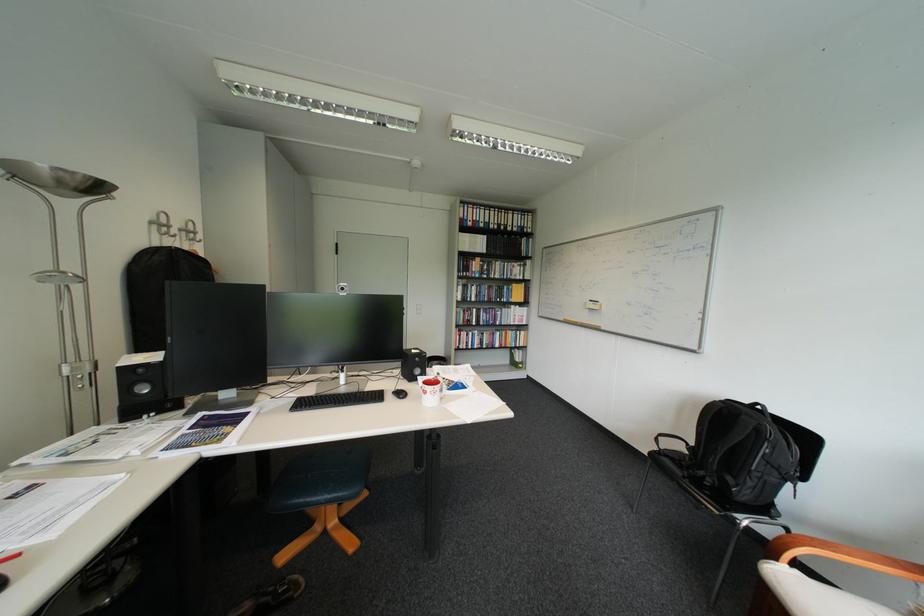
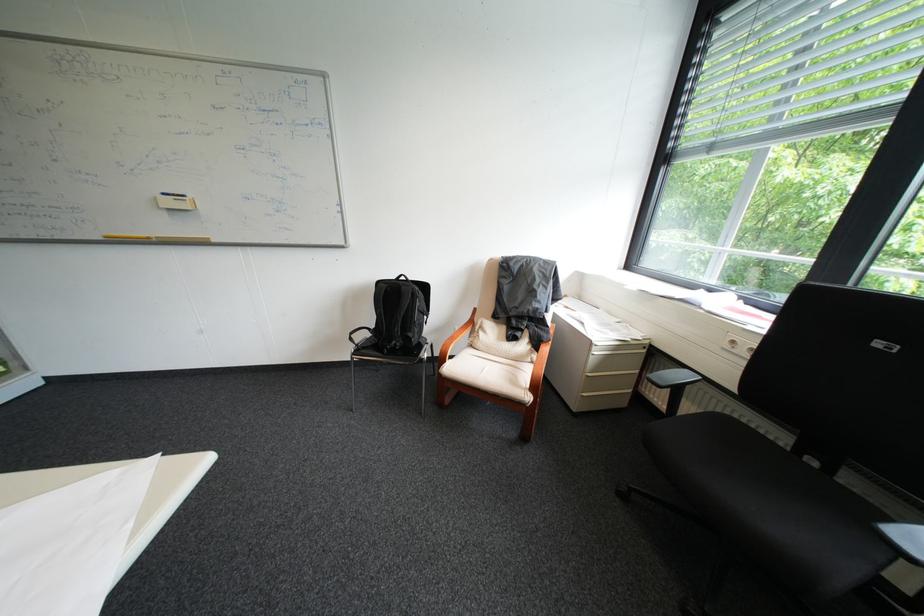
Where in the second image is the point corresponding to point 602,302 from the first image?

(176, 195)